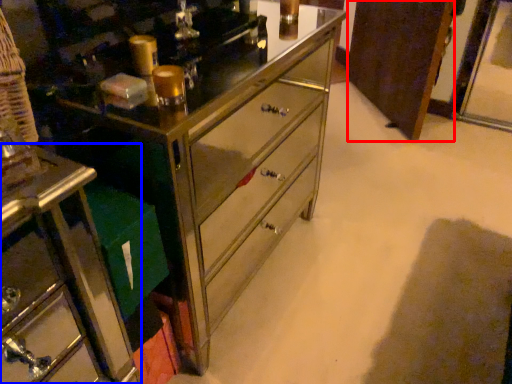
Question: Which point is further to the camera, cabinetry (highlighted by a red box) or furniture (highlighted by a blue box)?

Choices:
 (A) cabinetry
 (B) furniture

Answer: (A)